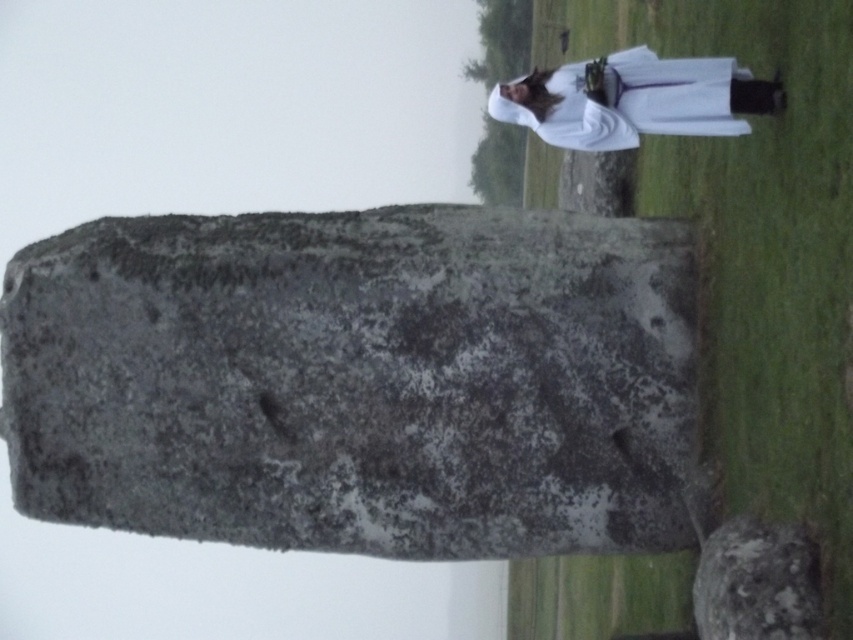
What do you see at coordinates (357, 380) in the screenshot?
I see `gray stone at center` at bounding box center [357, 380].

Consider the image. Can you confirm if gray stone at center is wider than gray rough stone at center?

Indeed, gray stone at center has a greater width compared to gray rough stone at center.

Who is more forward, (341, 272) or (722, 525)?

Point (722, 525) is more forward.

You are a GUI agent. You are given a task and a screenshot of the screen. Output one action in this format:
    pyautogui.click(x=<x>, y=<y>)
    Task: Click on the gray stone at center
    
    Given the screenshot: What is the action you would take?
    pyautogui.click(x=357, y=380)

Is white cloth at upper right smaller than gray rough stone at center?

Result: Correct, white cloth at upper right occupies less space than gray rough stone at center.

Is white cloth at upper right above gray rough stone at center?

Indeed, white cloth at upper right is positioned over gray rough stone at center.

The width and height of the screenshot is (853, 640). What do you see at coordinates (624, 100) in the screenshot? I see `white cloth at upper right` at bounding box center [624, 100].

Locate an element on the screen. The height and width of the screenshot is (640, 853). white cloth at upper right is located at coordinates (624, 100).

Describe the element at coordinates (357, 380) in the screenshot. I see `gray stone at center` at that location.

Is point (416, 250) farther from camera compared to point (711, 80)?

That is True.

Where is `gray stone at center`? gray stone at center is located at coordinates (357, 380).